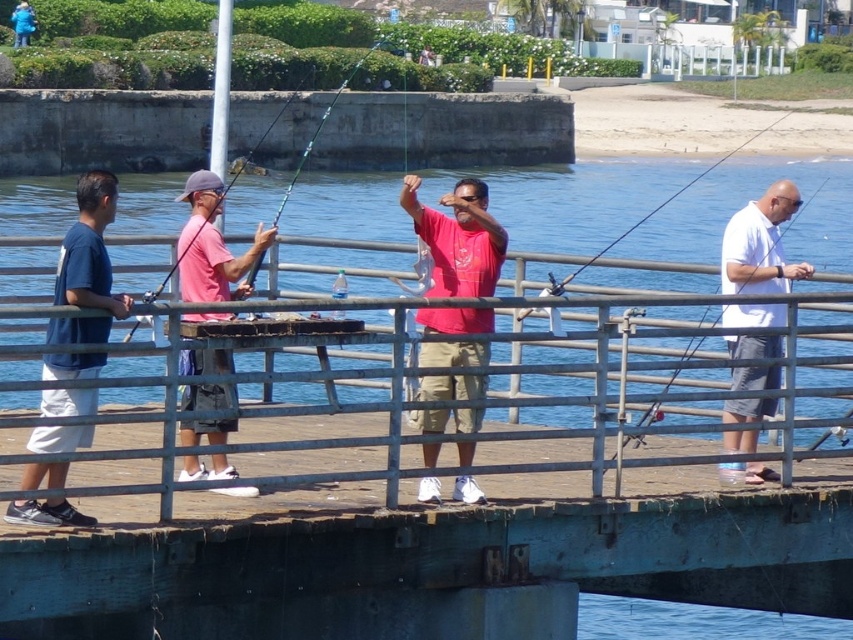
You are standing on the pier and want to move from the blue fabric jacket at upper left to the rustic wood dock at center. Which direction should you move in?

You should move to the right to reach the rustic wood dock at center from the blue fabric jacket at upper left because the dock is positioned to the right of the jacket.

You are standing on the wooden pier and want to cast your fishing line into the blue water at center. Which direction should you move to reach the blue water at center from your current position at point (x=743, y=204)?

The blue water at center is already located at point (x=743, y=204), so you are already positioned directly above it. No movement is necessary.